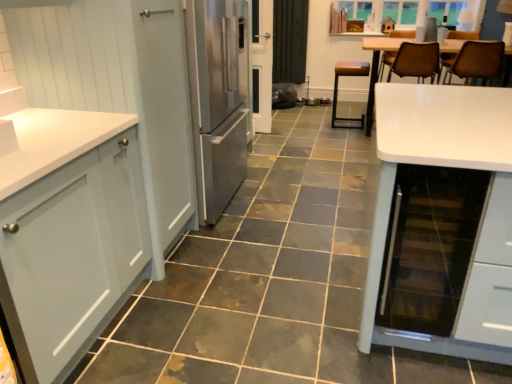
Question: Is brown leather chair at upper right, the 2th chair viewed from the left, looking in the opposite direction of matte gray cabinet at left, which ranks as the 2th cabinetry in back-to-front order?

Choices:
 (A) no
 (B) yes

Answer: (A)

Question: From a real-world perspective, is brown leather chair at upper right, the 2th chair viewed from the left, located beneath matte gray cabinet at left, which ranks as the 2th cabinetry in back-to-front order?

Choices:
 (A) no
 (B) yes

Answer: (A)

Question: Is brown leather chair at upper right, positioned as the second chair in right-to-left order, beside matte gray cabinet at left, which is the first cabinetry from front to back?

Choices:
 (A) no
 (B) yes

Answer: (A)

Question: Are brown leather chair at upper right, the 2th chair viewed from the left, and matte gray cabinet at left, which ranks as the 2th cabinetry in back-to-front order, far apart?

Choices:
 (A) no
 (B) yes

Answer: (B)

Question: Considering the relative sizes of brown leather chair at upper right, the 2th chair viewed from the left, and matte gray cabinet at left, which ranks as the 2th cabinetry in back-to-front order, in the image provided, is brown leather chair at upper right, the 2th chair viewed from the left, shorter than matte gray cabinet at left, which ranks as the 2th cabinetry in back-to-front order,?

Choices:
 (A) no
 (B) yes

Answer: (B)

Question: From the image's perspective, does brown leather chair at upper right, positioned as the second chair in right-to-left order, appear lower than matte gray cabinet at left, which ranks as the 2th cabinetry in back-to-front order?

Choices:
 (A) no
 (B) yes

Answer: (A)

Question: Is brown leather stool at center, acting as the third chair starting from the right, at the right side of white glossy screen door at center?

Choices:
 (A) no
 (B) yes

Answer: (B)

Question: Would you say brown leather stool at center, acting as the third chair starting from the right, is outside white glossy screen door at center?

Choices:
 (A) yes
 (B) no

Answer: (A)

Question: Does brown leather stool at center, which appears as the 1th chair when viewed from the left, have a greater height compared to white glossy screen door at center?

Choices:
 (A) yes
 (B) no

Answer: (B)

Question: Can you confirm if brown leather stool at center, which appears as the 1th chair when viewed from the left, is bigger than white glossy screen door at center?

Choices:
 (A) no
 (B) yes

Answer: (B)

Question: Is brown leather stool at center, acting as the third chair starting from the right, smaller than white glossy screen door at center?

Choices:
 (A) no
 (B) yes

Answer: (A)

Question: Is matte white cabinet at left, the second cabinetry when ordered from front to back, located within brown leather chair at upper right, which is counted as the first chair, starting from the right?

Choices:
 (A) no
 (B) yes

Answer: (A)